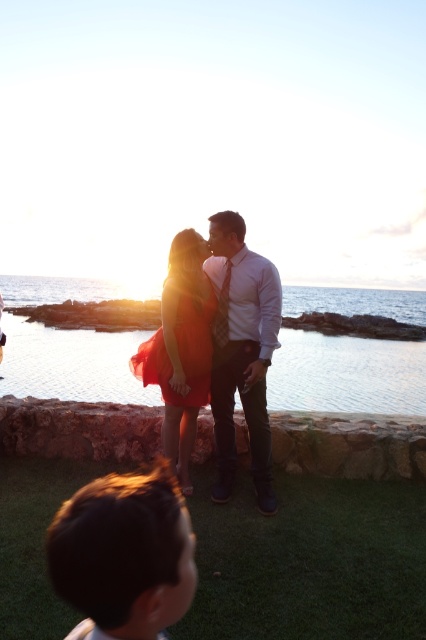
Question: Which object is the farthest from the transparent water at center?

Choices:
 (A) satin red dress at center
 (B) matte white shirt at center
 (C) shiny orange dress at center

Answer: (A)

Question: Estimate the real-world distances between objects in this image. Which object is farther from the shiny orange dress at center?

Choices:
 (A) matte white shirt at center
 (B) transparent water at center
 (C) satin red dress at center

Answer: (B)

Question: Which of the following is the closest to the observer?

Choices:
 (A) (23, 385)
 (B) (258, 394)
 (C) (144, 362)

Answer: (B)

Question: Can you confirm if matte white shirt at center is positioned to the right of satin red dress at center?

Choices:
 (A) yes
 (B) no

Answer: (A)

Question: Is matte white shirt at center further to camera compared to satin red dress at center?

Choices:
 (A) yes
 (B) no

Answer: (B)

Question: Is transparent water at center positioned before satin red dress at center?

Choices:
 (A) yes
 (B) no

Answer: (B)